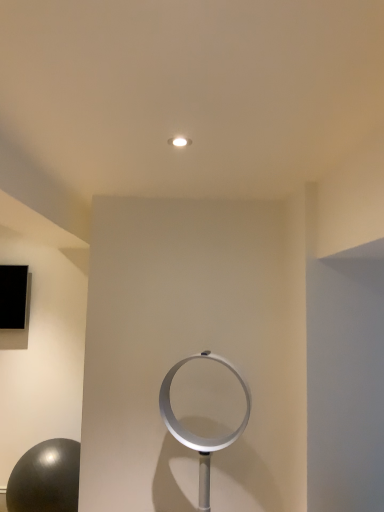
Question: Should I look upward or downward to see shiny black ball at lower left?

Choices:
 (A) down
 (B) up

Answer: (A)

Question: Would you say shiny black ball at lower left contains silver metallic fan at center?

Choices:
 (A) yes
 (B) no

Answer: (B)

Question: Is shiny black ball at lower left oriented away from silver metallic fan at center?

Choices:
 (A) no
 (B) yes

Answer: (A)

Question: Is shiny black ball at lower left wider than silver metallic fan at center?

Choices:
 (A) no
 (B) yes

Answer: (B)

Question: From a real-world perspective, is shiny black ball at lower left below silver metallic fan at center?

Choices:
 (A) yes
 (B) no

Answer: (A)

Question: From the image's perspective, is shiny black ball at lower left above silver metallic fan at center?

Choices:
 (A) yes
 (B) no

Answer: (B)

Question: Is shiny black ball at lower left positioned behind silver metallic fan at center?

Choices:
 (A) no
 (B) yes

Answer: (B)

Question: Are silver metallic fan at center and shiny black ball at lower left far apart?

Choices:
 (A) no
 (B) yes

Answer: (B)

Question: Does silver metallic fan at center have a lesser width compared to shiny black ball at lower left?

Choices:
 (A) yes
 (B) no

Answer: (A)

Question: From a real-world perspective, is silver metallic fan at center positioned over shiny black ball at lower left based on gravity?

Choices:
 (A) yes
 (B) no

Answer: (A)

Question: Is silver metallic fan at center positioned with its back to shiny black ball at lower left?

Choices:
 (A) no
 (B) yes

Answer: (A)

Question: Is silver metallic fan at center outside of shiny black ball at lower left?

Choices:
 (A) no
 (B) yes

Answer: (B)

Question: Is shiny black ball at lower left surrounded by silver metallic fan at center?

Choices:
 (A) no
 (B) yes

Answer: (A)

Question: Based on their sizes in the image, would you say shiny black ball at lower left is bigger or smaller than silver metallic fan at center?

Choices:
 (A) big
 (B) small

Answer: (A)